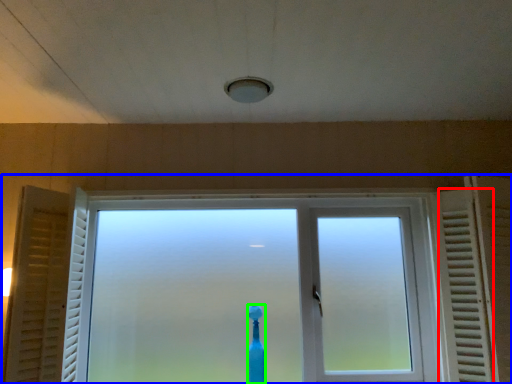
Question: Estimate the real-world distances between objects in this image. Which object is closer to radiator (highlighted by a red box), window (highlighted by a blue box) or toothbrush (highlighted by a green box)?

Choices:
 (A) window
 (B) toothbrush

Answer: (A)